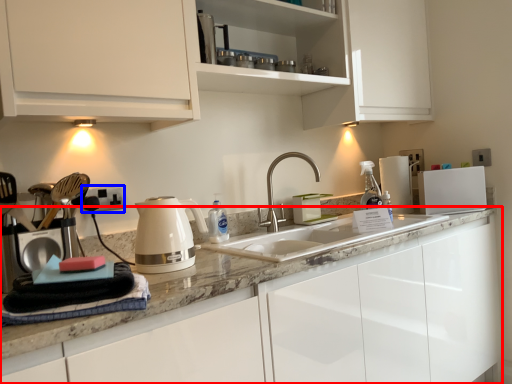
Question: Which point is closer to the camera, cabinetry (highlighted by a red box) or electric outlet (highlighted by a blue box)?

Choices:
 (A) cabinetry
 (B) electric outlet

Answer: (A)